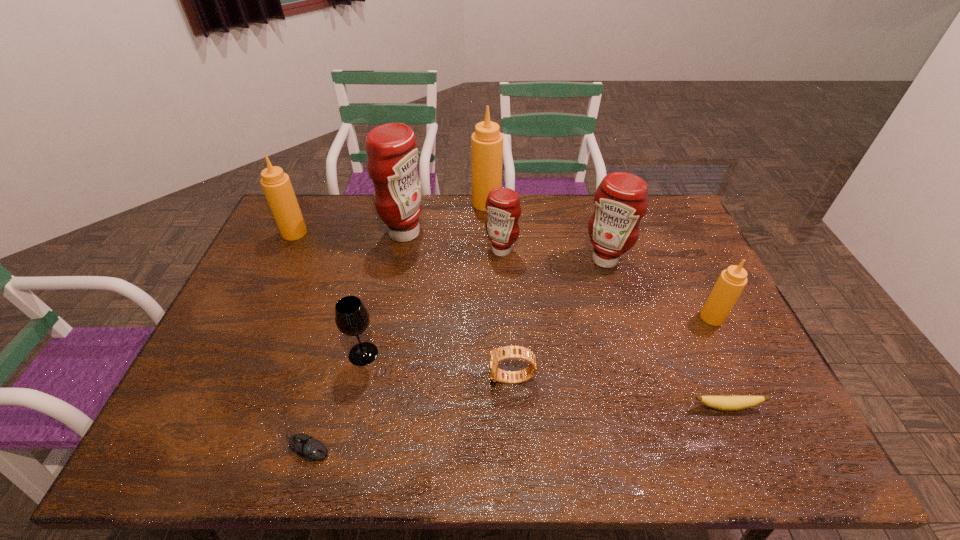
The height and width of the screenshot is (540, 960). I want to click on the smallest red condiment, so click(503, 208).

At what (x,y) coordinates should I click in order to perform the action: click on wineglass. Please return your answer as a coordinate pair (x, y). The width and height of the screenshot is (960, 540). Looking at the image, I should click on (352, 318).

This screenshot has height=540, width=960. I want to click on black watch, so click(497, 355).

At what (x,y) coordinates should I click in order to perform the action: click on the third shortest object. Please return your answer as a coordinate pair (x, y). The image size is (960, 540). Looking at the image, I should click on (497, 355).

I want to click on the second nearest object, so click(x=726, y=403).

Find the location of a particular element. The height and width of the screenshot is (540, 960). yellow banana is located at coordinates (726, 403).

You are a GUI agent. You are given a task and a screenshot of the screen. Output one action in this format:
    pyautogui.click(x=<x>, y=<y>)
    Task: Click on the shortest object
    
    Given the screenshot: What is the action you would take?
    pos(305,446)

Locate an element on the screen. the nearest object is located at coordinates (305, 446).

The image size is (960, 540). In order to click on vacant space located 0.400m on the left of the second tan condiment from right to left in this screenshot , I will do `click(366, 203)`.

Where is `vacant space situated on the back of the second condiment from left to right`? vacant space situated on the back of the second condiment from left to right is located at coordinates (411, 196).